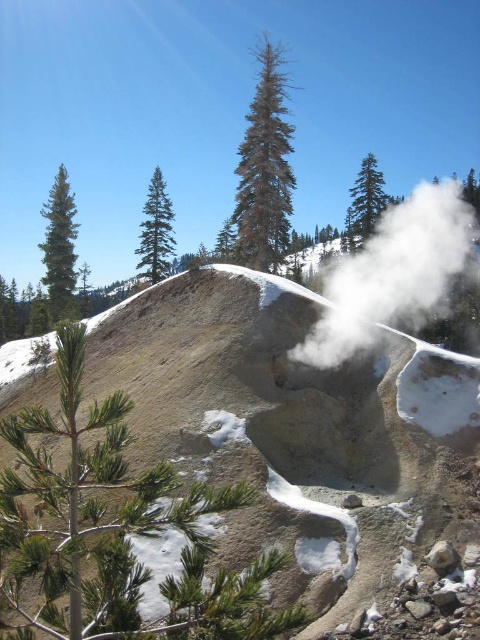
The height and width of the screenshot is (640, 480). What do you see at coordinates (264, 168) in the screenshot?
I see `gray-brown coniferous tree at center` at bounding box center [264, 168].

Does point (255, 100) come behind point (228, 259)?

No, it is not.

Where is `gray-brown coniferous tree at center`? gray-brown coniferous tree at center is located at coordinates [264, 168].

This screenshot has width=480, height=640. What do you see at coordinates (264, 168) in the screenshot? I see `gray-brown coniferous tree at center` at bounding box center [264, 168].

Which is more to the left, gray-brown coniferous tree at center or green matte tree at left?

Positioned to the left is green matte tree at left.

Who is more distant from viewer, (283, 248) or (57, 288)?

Point (283, 248)

This screenshot has width=480, height=640. Find the location of `gray-brown coniferous tree at center`. gray-brown coniferous tree at center is located at coordinates (264, 168).

Can you confirm if green textured pine tree at upper center is wider than green matte tree at upper center?

Indeed, green textured pine tree at upper center has a greater width compared to green matte tree at upper center.

Who is shorter, green textured pine tree at upper center or green matte tree at upper center?

green matte tree at upper center

Is point (373, 196) positioned before point (229, 237)?

Yes, point (373, 196) is closer to viewer.

In order to click on green textured pine tree at upper center in this screenshot , I will do `click(364, 202)`.